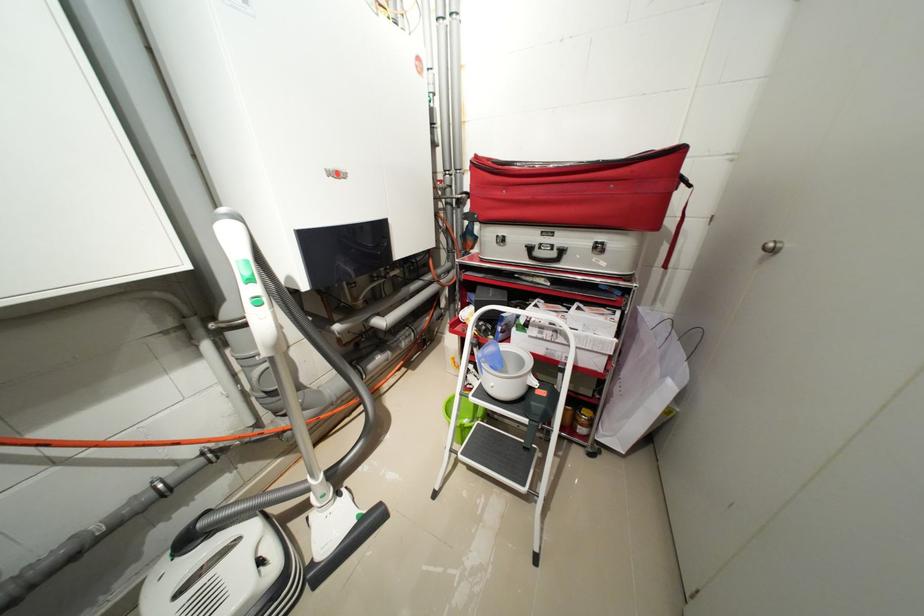
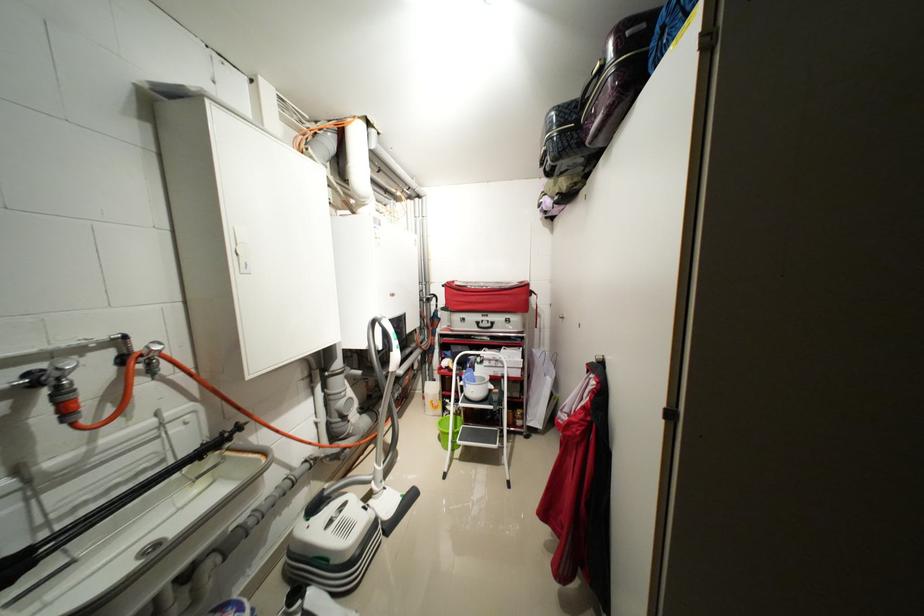
Where in the second image is the point corresponding to the point at 599,424 from the first image?

(530, 418)